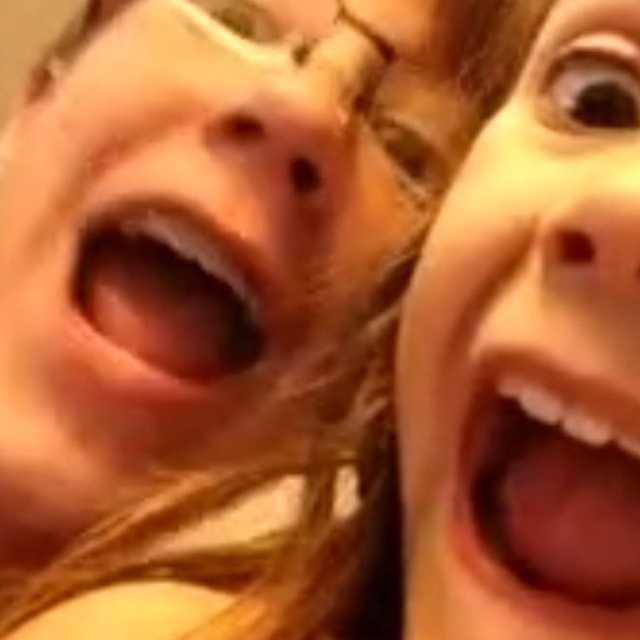
You are taking a selfie and want to focus on two points in the image, point 1 at point (452, 408) and point 2 at point (630, 577). Which point is closer to the camera?

Point (452, 408) is further to the camera than point (630, 577), so point (630, 577) is closer to the camera.

You are a photographer trying to capture a clear selfie. You notice the smooth skin face at upper right is currently 31.98 centimeters away from the camera. What adjustment should you make to ensure the face is in focus?

To ensure the smooth skin face at upper right is in focus, move it closer to the camera since it is currently 31.98 centimeters away, which may be beyond the optimal focus range for a clear selfie.